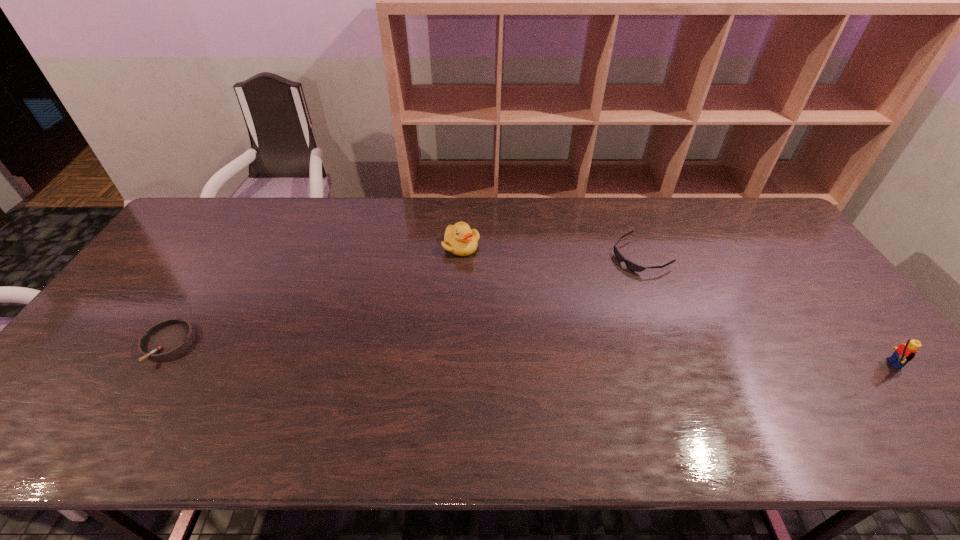
The height and width of the screenshot is (540, 960). In order to click on vacant spot on the desktop that is between the second shortest object and the Lego and is positioned on the front-facing side of the duckling in this screenshot , I will do `click(467, 353)`.

You are a GUI agent. You are given a task and a screenshot of the screen. Output one action in this format:
    pyautogui.click(x=<x>, y=<y>)
    Task: Click on the free space on the desktop that is between the ashtray and the tallest object and is positioned on the front-facing side of the shortest object
    The height and width of the screenshot is (540, 960).
    Given the screenshot: What is the action you would take?
    pyautogui.click(x=453, y=352)